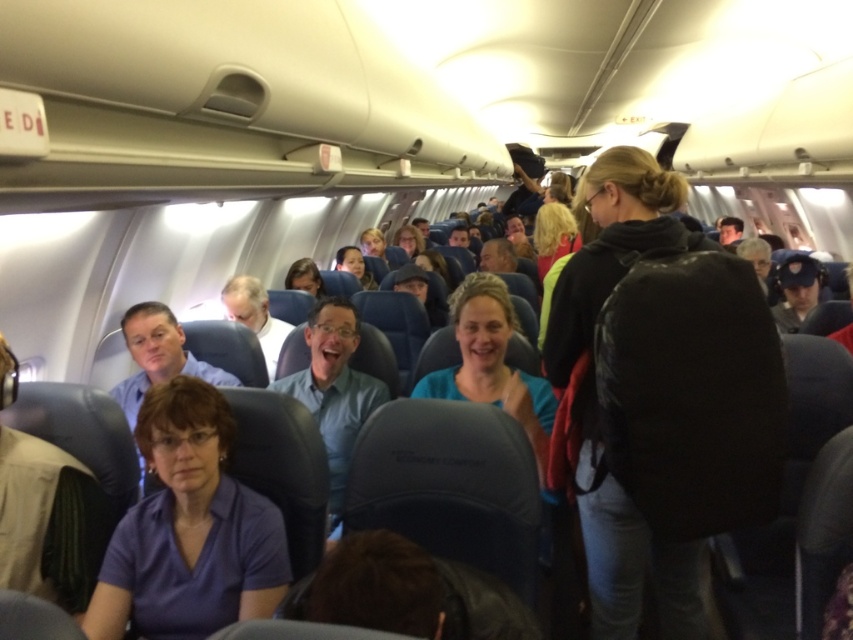
Question: Can you confirm if black leather jacket at upper right is smaller than light blue shirt at center?

Choices:
 (A) no
 (B) yes

Answer: (A)

Question: Is black leather jacket at upper right to the left of light blue shirt at center from the viewer's perspective?

Choices:
 (A) no
 (B) yes

Answer: (A)

Question: Observing the image, what is the correct spatial positioning of black leather jacket at upper right in reference to light blue shirt at center?

Choices:
 (A) left
 (B) right

Answer: (B)

Question: Which of the following is the farthest from the observer?

Choices:
 (A) light blue shirt at center
 (B) black leather jacket at upper right

Answer: (A)

Question: Which point is farther to the camera?

Choices:
 (A) (625, 605)
 (B) (335, 316)

Answer: (B)